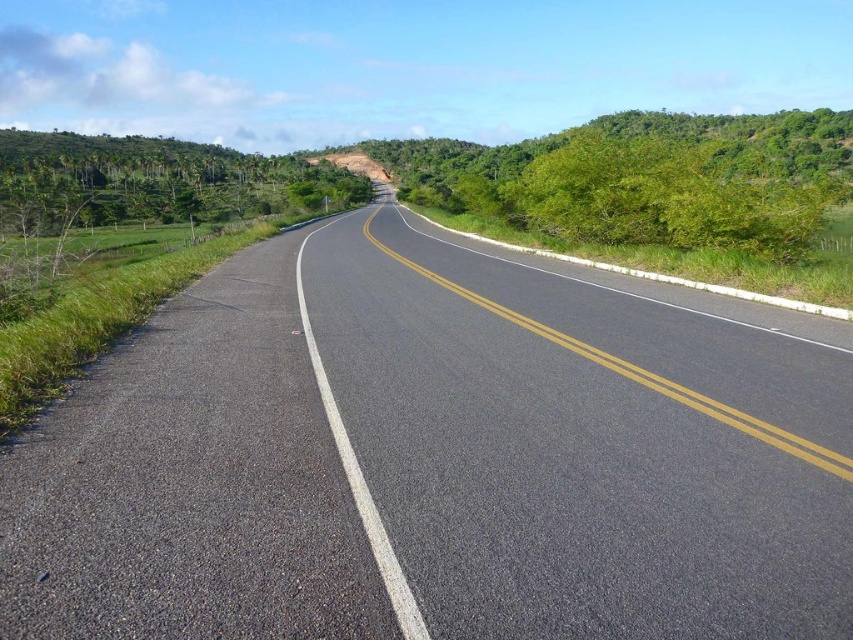
Is green leafy bush at center above green leafy trees at left?

Incorrect, green leafy bush at center is not positioned above green leafy trees at left.

What do you see at coordinates (646, 179) in the screenshot? The height and width of the screenshot is (640, 853). I see `green leafy bush at center` at bounding box center [646, 179].

The width and height of the screenshot is (853, 640). I want to click on green leafy bush at center, so click(646, 179).

Can you confirm if asphalt road at center is positioned below green leafy bush at center?

Yes.

Which of these two, asphalt road at center or green leafy bush at center, stands shorter?

asphalt road at center

Is point (373, 348) positioned in front of point (730, 188)?

Yes, it is in front of point (730, 188).

I want to click on asphalt road at center, so click(x=434, y=460).

Between point (425, 268) and point (221, 152), which one is positioned behind?

The point (221, 152) is behind.

Can you confirm if asphalt road at center is shorter than green leafy trees at left?

Correct, asphalt road at center is not as tall as green leafy trees at left.

Measure the distance between point [115,364] and camera.

They are 25.94 feet apart.

Locate an element on the screen. The image size is (853, 640). asphalt road at center is located at coordinates (434, 460).